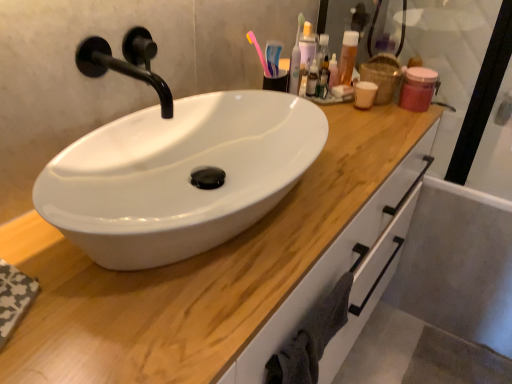
Question: Considering the relative sizes of gray cotton towel at lower right and wooden at center in the image provided, is gray cotton towel at lower right shorter than wooden at center?

Choices:
 (A) no
 (B) yes

Answer: (B)

Question: Is gray cotton towel at lower right outside of wooden at center?

Choices:
 (A) no
 (B) yes

Answer: (A)

Question: Is gray cotton towel at lower right to the left of wooden at center from the viewer's perspective?

Choices:
 (A) yes
 (B) no

Answer: (B)

Question: Is gray cotton towel at lower right wider than wooden at center?

Choices:
 (A) no
 (B) yes

Answer: (A)

Question: From a real-world perspective, is gray cotton towel at lower right below wooden at center?

Choices:
 (A) yes
 (B) no

Answer: (B)

Question: Is wooden at center at the back of gray cotton towel at lower right?

Choices:
 (A) no
 (B) yes

Answer: (B)

Question: Is pink plastic toothbrush at upper right aimed at gray cotton towel at lower right?

Choices:
 (A) no
 (B) yes

Answer: (A)

Question: Can you confirm if pink plastic toothbrush at upper right is bigger than gray cotton towel at lower right?

Choices:
 (A) no
 (B) yes

Answer: (A)

Question: Is gray cotton towel at lower right at the back of pink plastic toothbrush at upper right?

Choices:
 (A) no
 (B) yes

Answer: (A)

Question: Can you confirm if pink plastic toothbrush at upper right is taller than gray cotton towel at lower right?

Choices:
 (A) no
 (B) yes

Answer: (B)

Question: Is pink plastic toothbrush at upper right located outside gray cotton towel at lower right?

Choices:
 (A) yes
 (B) no

Answer: (A)

Question: Does pink plastic toothbrush at upper right have a greater width compared to gray cotton towel at lower right?

Choices:
 (A) no
 (B) yes

Answer: (A)

Question: From a real-world perspective, is translucent plastic bottle at upper right on wooden at center?

Choices:
 (A) no
 (B) yes

Answer: (B)